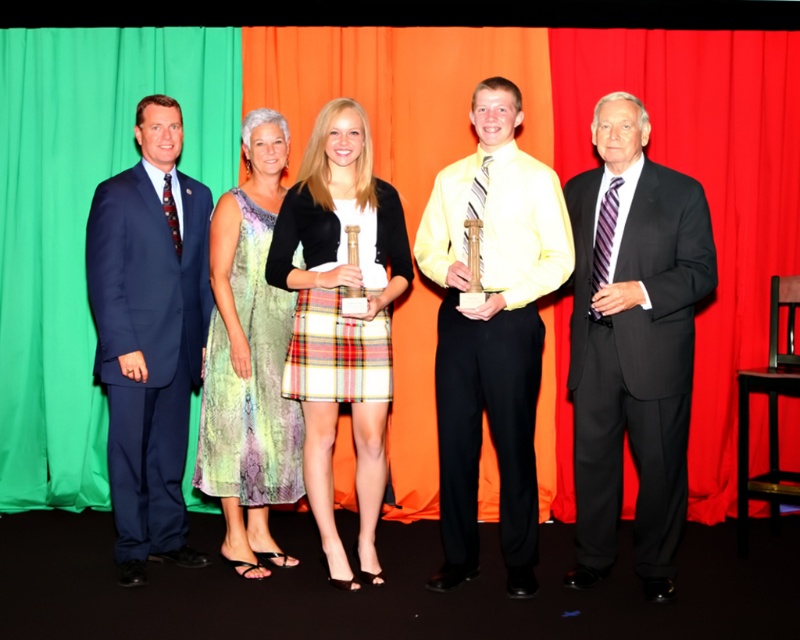
You are a photographer reviewing this group photo. You notice two clothing items at the center of the image, a plaid skirt at center and a multicolored printed dress at center. Which clothing item is located lower in the image?

The plaid skirt at center is positioned under the multicolored printed dress at center, so the plaid skirt at center is lower in the image.